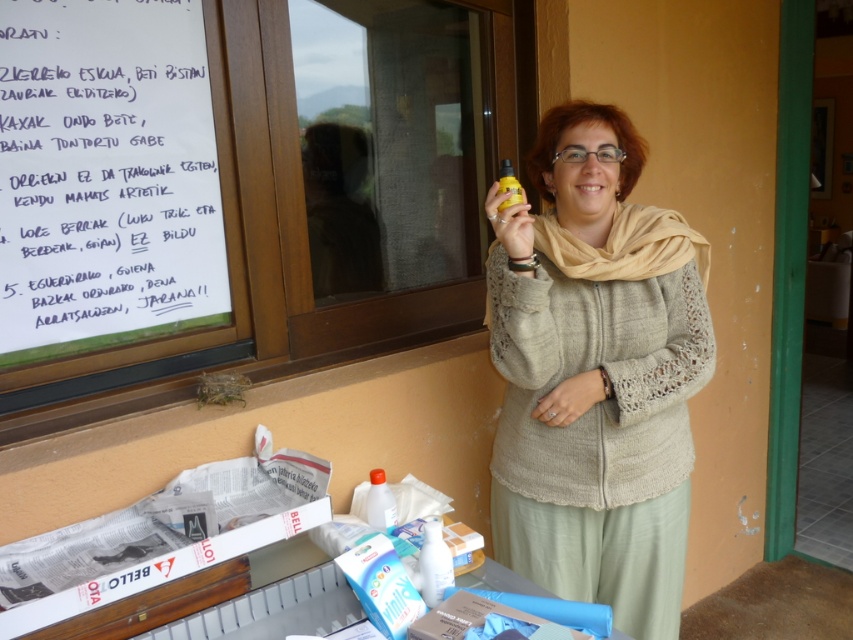
Question: Can you confirm if translucent plastic bottle at lower center is positioned to the right of yellow matte bottle at upper center?

Choices:
 (A) yes
 (B) no

Answer: (B)

Question: Which point appears farthest from the camera in this image?

Choices:
 (A) (370, 476)
 (B) (505, 188)

Answer: (A)

Question: Observing the image, what is the correct spatial positioning of knitted beige sweater at center in reference to yellow matte bottle at upper center?

Choices:
 (A) below
 (B) above

Answer: (A)

Question: Which is farther from the yellow matte bottle at upper center?

Choices:
 (A) translucent plastic bottle at lower center
 (B) knitted beige sweater at center

Answer: (A)

Question: Does translucent plastic bottle at lower center have a greater width compared to yellow matte bottle at upper center?

Choices:
 (A) yes
 (B) no

Answer: (A)

Question: Which point is farther to the camera?

Choices:
 (A) [x=628, y=365]
 (B) [x=512, y=180]

Answer: (A)